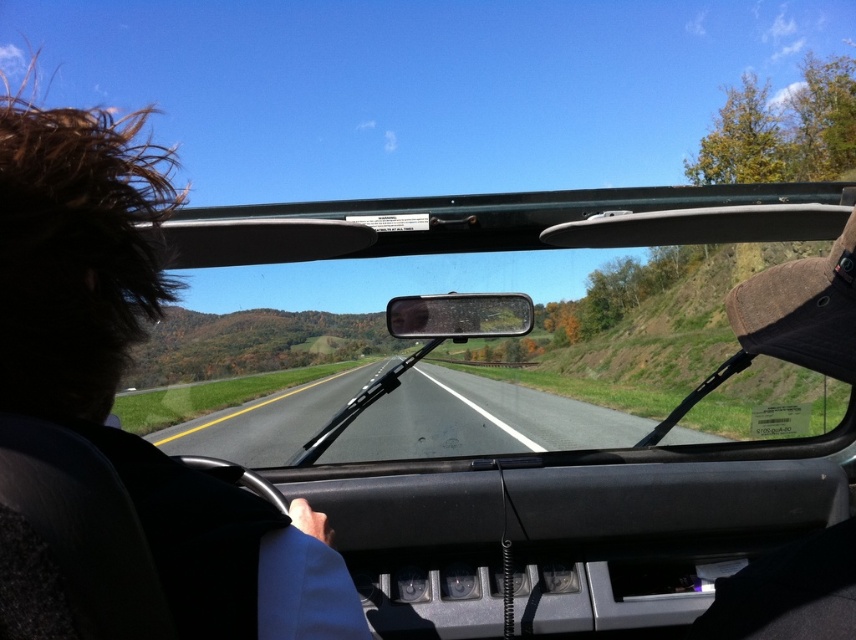
Question: Considering the real-world distances, which object is closest to the transparent glass windshield at center?

Choices:
 (A) brown hair at upper left
 (B) asphalt road at center

Answer: (B)

Question: Which point is closer to the camera?

Choices:
 (A) (471, 452)
 (B) (72, 342)

Answer: (B)

Question: Can you confirm if brown hair at upper left is positioned below asphalt road at center?

Choices:
 (A) yes
 (B) no

Answer: (B)

Question: Estimate the real-world distances between objects in this image. Which object is farther from the brown hair at upper left?

Choices:
 (A) transparent glass windshield at center
 (B) asphalt road at center

Answer: (A)

Question: Is brown hair at upper left to the right of asphalt road at center from the viewer's perspective?

Choices:
 (A) yes
 (B) no

Answer: (B)

Question: Is transparent glass windshield at center in front of asphalt road at center?

Choices:
 (A) yes
 (B) no

Answer: (A)